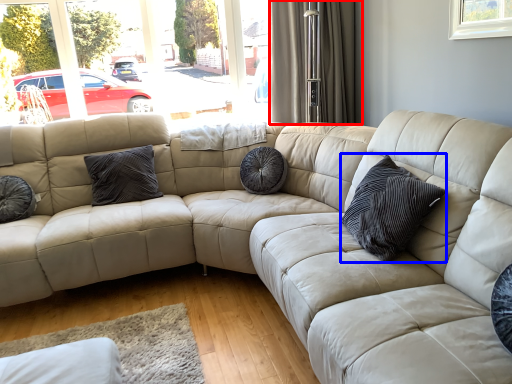
Question: Which point is closer to the camera, curtain (highlighted by a red box) or pillow (highlighted by a blue box)?

Choices:
 (A) curtain
 (B) pillow

Answer: (B)